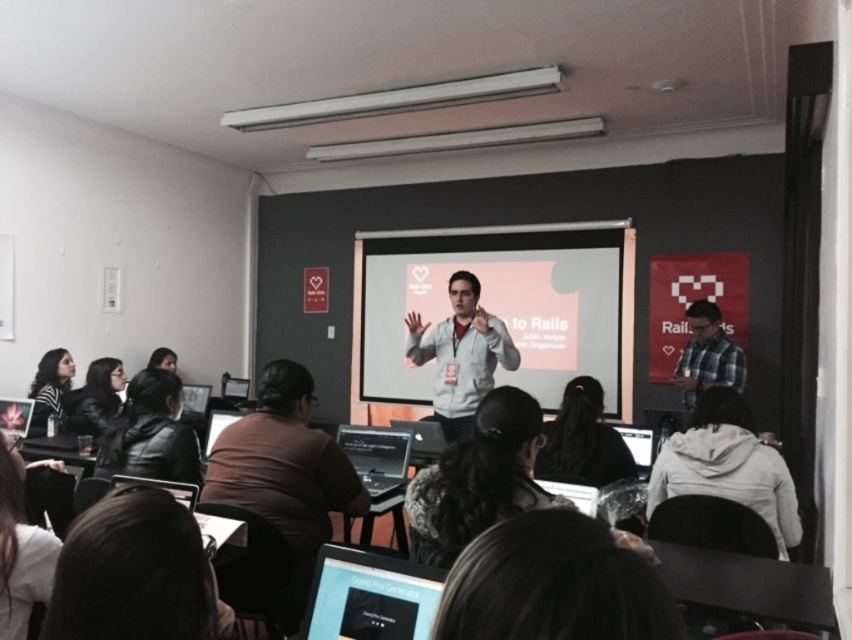
You are a student sitting at the back of the classroom. You see two points on the screen labeled as point (332, 504) and point (470, 417). Which point is closer to you?

Point (470, 417) is closer to you because it is behind point (332, 504).

You are a student sitting in the classroom and want to hand in an assignment to the professor who is standing by the striped sweater at lower left. You are currently facing the white matte projector screen at center. Which direction should you move to reach the professor?

Since the white matte projector screen at center is further to the viewer than the striped sweater at lower left, you should move backward towards the striped sweater at lower left to reach the professor.